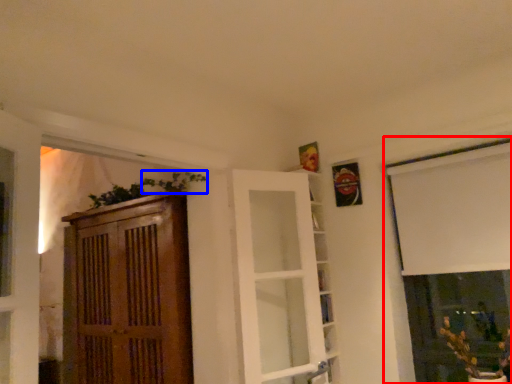
Question: Which object is closer to the camera taking this photo, window (highlighted by a red box) or plant (highlighted by a blue box)?

Choices:
 (A) window
 (B) plant

Answer: (A)